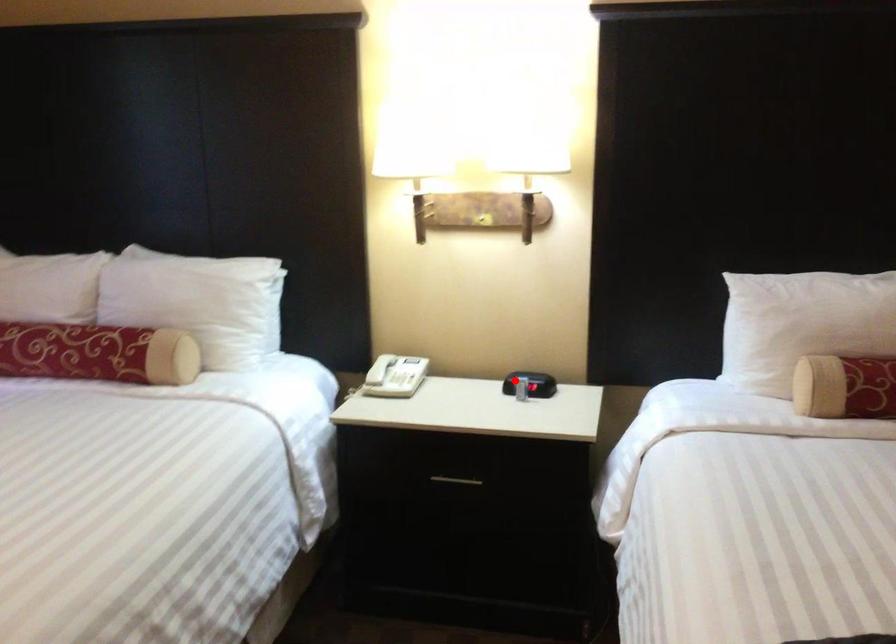
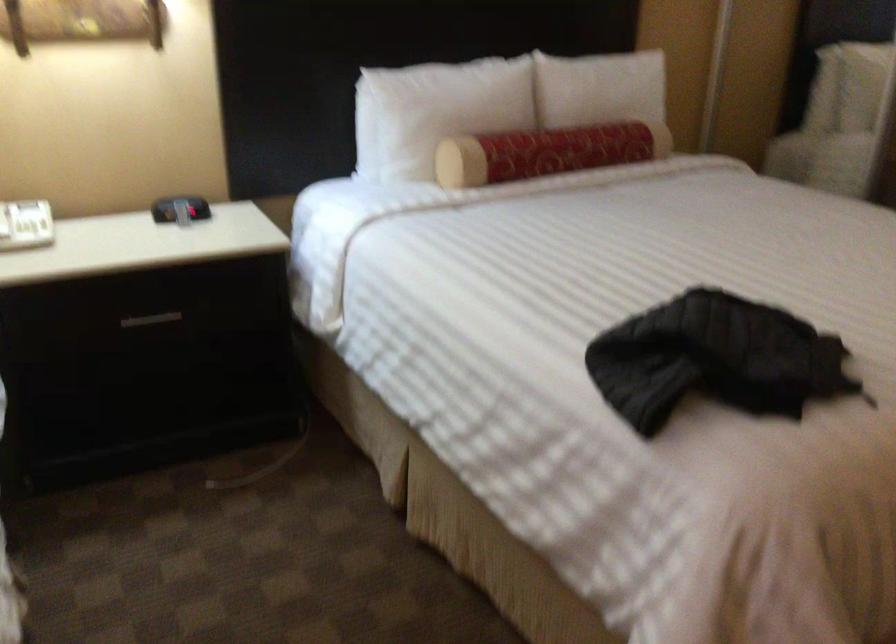
Find the pixel in the second image that matches the highlighted location in the first image.

(179, 209)